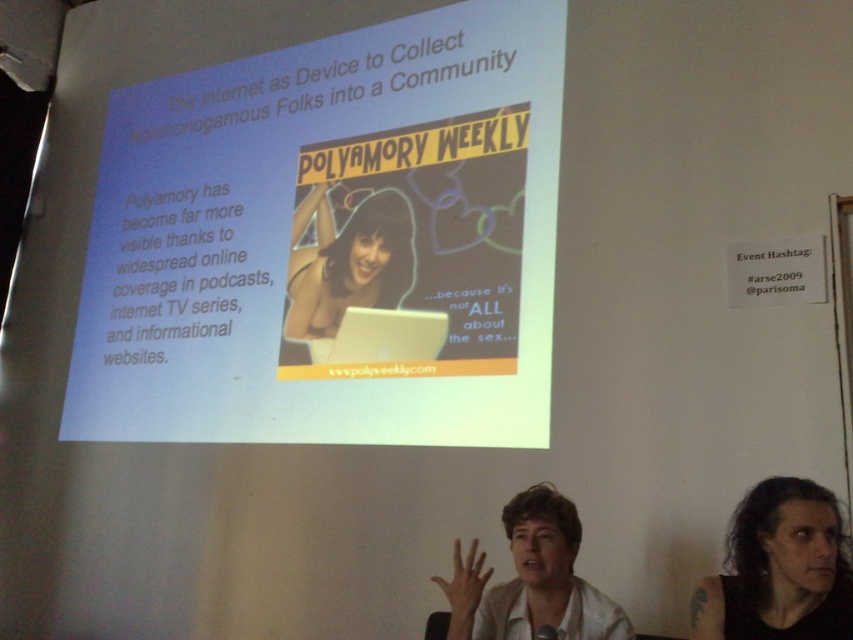
Question: Which object appears closest to the camera in this image?

Choices:
 (A) matte yellow poster at center
 (B) white matte shirt at center
 (C) matte black laptop at center

Answer: (B)

Question: Is matte yellow poster at center to the right of matte black laptop at center from the viewer's perspective?

Choices:
 (A) yes
 (B) no

Answer: (B)

Question: Which point is farther to the camera?

Choices:
 (A) matte black laptop at center
 (B) white matte shirt at center
 (C) dark brown hair at lower right

Answer: (A)

Question: Can you confirm if matte yellow poster at center is smaller than white matte shirt at center?

Choices:
 (A) yes
 (B) no

Answer: (B)

Question: Which point is closer to the camera taking this photo?

Choices:
 (A) (393, 275)
 (B) (844, 556)
 (C) (566, 612)
 (D) (312, 109)

Answer: (B)

Question: Is dark brown hair at lower right to the left of white matte shirt at center from the viewer's perspective?

Choices:
 (A) yes
 (B) no

Answer: (B)